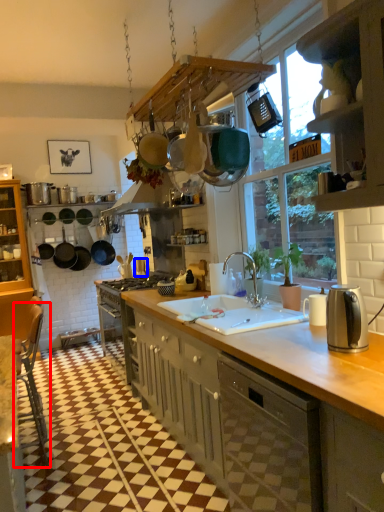
Question: Which object is further to the camera taking this photo, chair (highlighted by a red box) or appliance (highlighted by a blue box)?

Choices:
 (A) chair
 (B) appliance

Answer: (B)